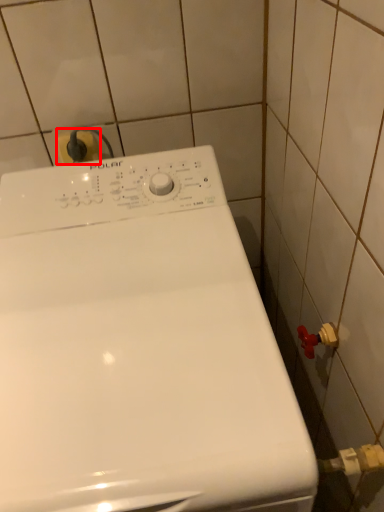
Question: In this image, where is electric outlet (annotated by the red box) located relative to washing machine?

Choices:
 (A) left
 (B) right

Answer: (A)